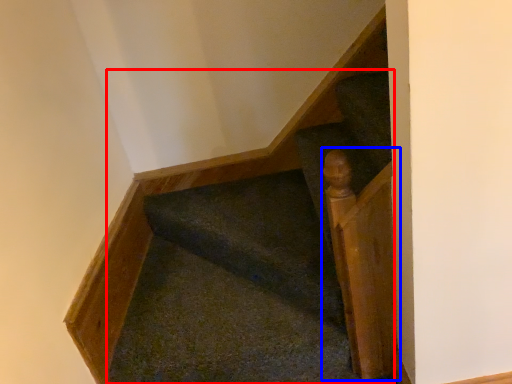
Question: Which point is further to the camera, stairs (highlighted by a red box) or rail (highlighted by a blue box)?

Choices:
 (A) stairs
 (B) rail

Answer: (A)